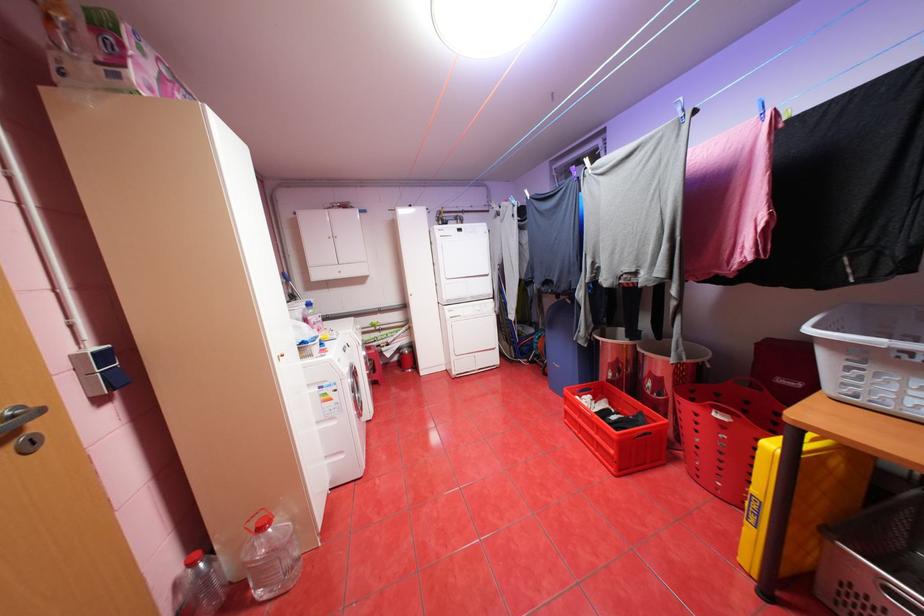
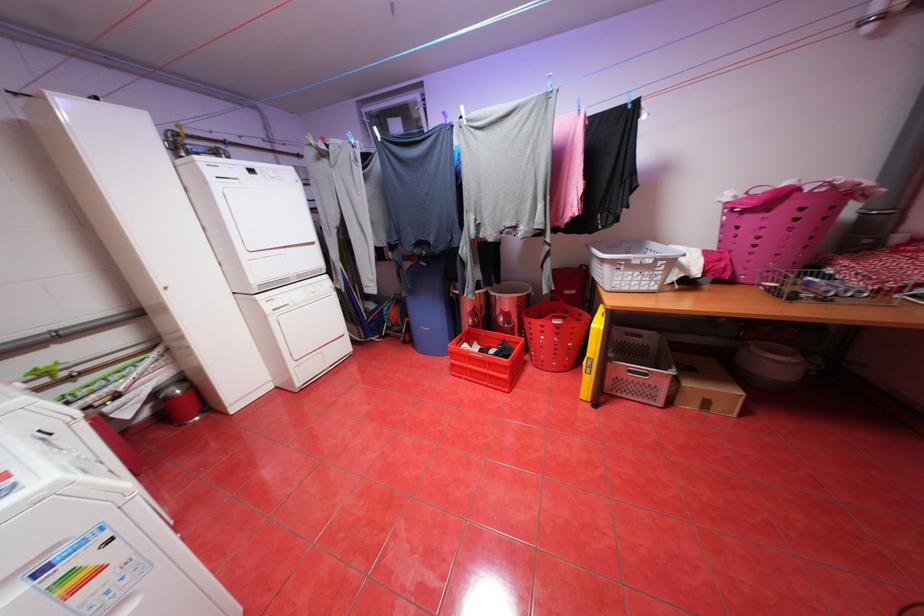
In the second image, find the point that corresponds to pixel 578 302 in the first image.

(433, 264)